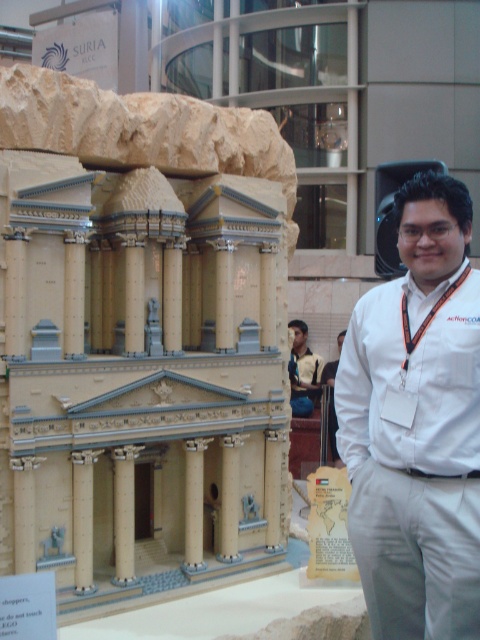
Question: Which object appears farthest from the camera in this image?

Choices:
 (A) light brown leather jacket at lower right
 (B) white cotton shirt at center
 (C) beige concrete column at center
 (D) beige stone column at center

Answer: (A)

Question: Is beige concrete column at center to the left of light brown leather jacket at lower right from the viewer's perspective?

Choices:
 (A) yes
 (B) no

Answer: (A)

Question: Is beige wood column at center below white shirt at center?

Choices:
 (A) yes
 (B) no

Answer: (A)

Question: Does beige stone column at center come behind white shirt at center?

Choices:
 (A) no
 (B) yes

Answer: (A)

Question: Among these objects, which one is nearest to the camera?

Choices:
 (A) beige wood column at center
 (B) beige concrete column at center

Answer: (B)

Question: Considering the real-world distances, which object is closest to the light brown leather jacket at lower right?

Choices:
 (A) beige stone column at center
 (B) beige wood column at center

Answer: (A)